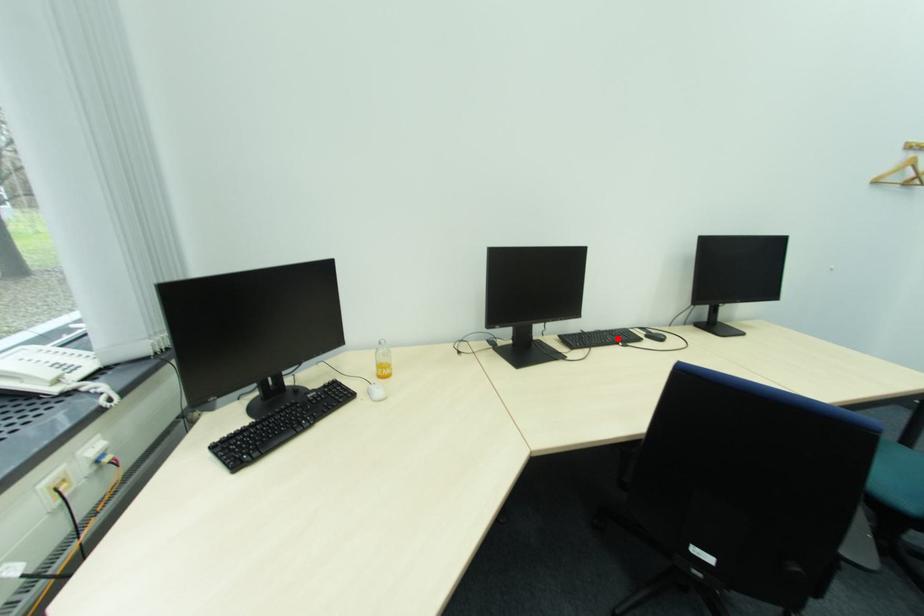
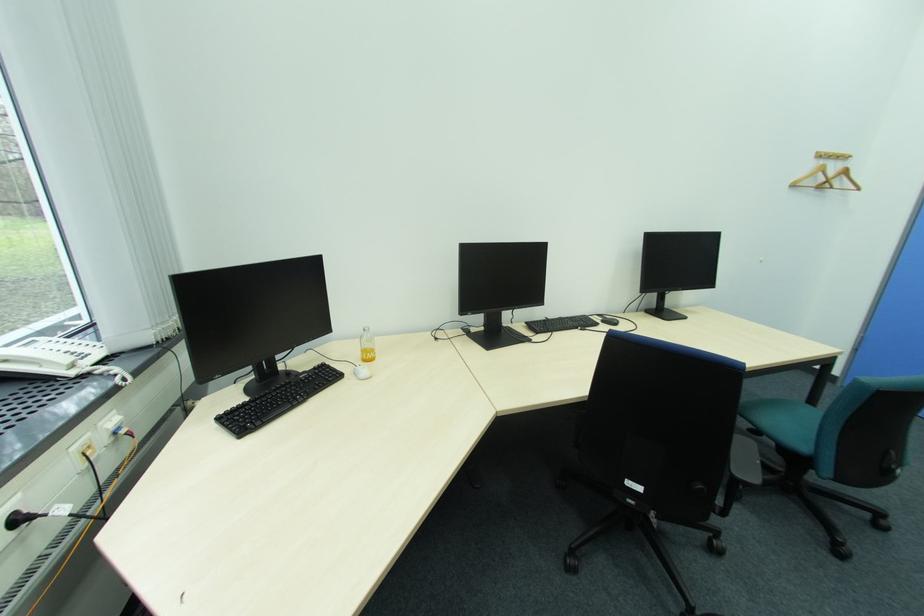
In the second image, find the point that corresponds to the highlighted location in the first image.

(578, 323)